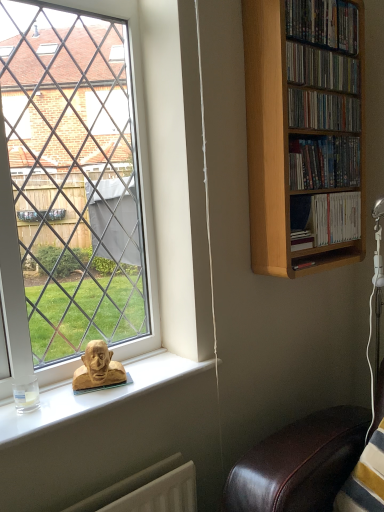
You are a GUI agent. You are given a task and a screenshot of the screen. Output one action in this format:
    pyautogui.click(x=<x>, y=<y>)
    Task: Click on the wooden shelf at upper right, marked as the second book in a top-to-bottom arrangement
    
    Given the screenshot: What is the action you would take?
    pyautogui.click(x=322, y=68)

In order to face light brown wooden bookcase at right, should I rotate leftwards or rightwards?

You should look right and rotate roughly 15.928 degrees.

This screenshot has width=384, height=512. Find the location of `wooden shelf at upper right, which is counted as the fourth book, starting from the bottom`. wooden shelf at upper right, which is counted as the fourth book, starting from the bottom is located at coordinates (322, 68).

Relative to wooden dvds at upper right, which is the third book from top to bottom, is translucent glass coffee cup at lower left in front or behind?

In the image, translucent glass coffee cup at lower left appears in front of wooden dvds at upper right, which is the third book from top to bottom.

Locate an element on the screen. coffee cup below the wooden dvds at upper right, arranged as the 3th book when ordered from the bottom (from a real-world perspective) is located at coordinates (26, 393).

How many degrees apart are the facing directions of translucent glass coffee cup at lower left and wooden dvds at upper right, which is the third book from top to bottom?

The angular difference between translucent glass coffee cup at lower left and wooden dvds at upper right, which is the third book from top to bottom, is 2.16 degrees.

Is translucent glass coffee cup at lower left to the left of wooden dvds at upper right, which is the third book from top to bottom, from the viewer's perspective?

Indeed, translucent glass coffee cup at lower left is positioned on the left side of wooden dvds at upper right, which is the third book from top to bottom.

From their relative heights in the image, would you say wooden sculpture at window is taller or shorter than translucent glass coffee cup at lower left?

wooden sculpture at window is taller than translucent glass coffee cup at lower left.

Is wooden sculpture at window in front of or behind translucent glass coffee cup at lower left in the image?

wooden sculpture at window is positioned farther from the viewer than translucent glass coffee cup at lower left.

Could you tell me if wooden sculpture at window is turned towards translucent glass coffee cup at lower left?

No, wooden sculpture at window is not turned towards translucent glass coffee cup at lower left.

Visually, is wooden sculpture at window positioned to the left or to the right of translucent glass coffee cup at lower left?

wooden sculpture at window is to the right of translucent glass coffee cup at lower left.

Between wooden dvds at upper right, arranged as the 1th book when viewed from the top, and wooden dvds at upper right, arranged as the 3th book when ordered from the bottom, which one has smaller size?

Smaller between the two is wooden dvds at upper right, arranged as the 3th book when ordered from the bottom.

Looking at this image, from a real-world perspective, is wooden dvds at upper right, arranged as the 1th book when viewed from the top, positioned above or below wooden dvds at upper right, arranged as the 3th book when ordered from the bottom?

Clearly, from a real-world perspective, wooden dvds at upper right, arranged as the 1th book when viewed from the top, is above wooden dvds at upper right, arranged as the 3th book when ordered from the bottom.

Considering the sizes of objects wooden dvds at upper right, arranged as the 1th book when viewed from the top, and wooden dvds at upper right, which is the third book from top to bottom, in the image provided, who is thinner, wooden dvds at upper right, arranged as the 1th book when viewed from the top, or wooden dvds at upper right, which is the third book from top to bottom,?

With smaller width is wooden dvds at upper right, which is the third book from top to bottom.

Which object is closer to the camera taking this photo, light brown wooden bookcase at right or translucent glass coffee cup at lower left?

Positioned in front is translucent glass coffee cup at lower left.

Considering the relative sizes of light brown wooden bookcase at right and translucent glass coffee cup at lower left in the image provided, is light brown wooden bookcase at right bigger than translucent glass coffee cup at lower left?

Indeed, light brown wooden bookcase at right has a larger size compared to translucent glass coffee cup at lower left.

From a real-world perspective, between light brown wooden bookcase at right and translucent glass coffee cup at lower left, who is vertically higher?

light brown wooden bookcase at right is physically above.

How many degrees apart are the facing directions of light brown wooden bookcase at right and translucent glass coffee cup at lower left?

There is a 2.48-degree angle between the facing directions of light brown wooden bookcase at right and translucent glass coffee cup at lower left.

Between translucent glass coffee cup at lower left and wooden sculpture at window, which one is positioned behind?

wooden sculpture at window is more distant.

Can you confirm if translucent glass coffee cup at lower left is shorter than wooden sculpture at window?

Correct, translucent glass coffee cup at lower left is not as tall as wooden sculpture at window.

From a real-world perspective, is translucent glass coffee cup at lower left located beneath wooden sculpture at window?

Indeed, from a real-world perspective, translucent glass coffee cup at lower left is positioned beneath wooden sculpture at window.

Find the location of a particular element. This screenshot has width=384, height=512. coffee cup located on the left of wooden sculpture at window is located at coordinates (26, 393).

Considering the relative sizes of wooden dvds at upper right, which is counted as the 5th book, starting from the bottom, and white paperbacks at upper right, which is counted as the fifth book, starting from the top, in the image provided, is wooden dvds at upper right, which is counted as the 5th book, starting from the bottom, shorter than white paperbacks at upper right, which is counted as the fifth book, starting from the top,?

Yes.

Is wooden dvds at upper right, which is counted as the 5th book, starting from the bottom, not within white paperbacks at upper right, the first book in the bottom-to-top sequence?

Yes.

Is wooden dvds at upper right, arranged as the 1th book when viewed from the top, smaller than white paperbacks at upper right, the first book in the bottom-to-top sequence?

Incorrect, wooden dvds at upper right, arranged as the 1th book when viewed from the top, is not smaller in size than white paperbacks at upper right, the first book in the bottom-to-top sequence.

Are wooden dvds at upper right, arranged as the 1th book when viewed from the top, and white paperbacks at upper right, which is counted as the fifth book, starting from the top, making contact?

wooden dvds at upper right, arranged as the 1th book when viewed from the top, and white paperbacks at upper right, which is counted as the fifth book, starting from the top, are not in contact.

Considering the sizes of objects translucent glass coffee cup at lower left and light brown wooden bookcase at right in the image provided, who is wider, translucent glass coffee cup at lower left or light brown wooden bookcase at right?

light brown wooden bookcase at right.

Based on the photo, from a real-world perspective, which is physically below, translucent glass coffee cup at lower left or light brown wooden bookcase at right?

In real-world perspective, translucent glass coffee cup at lower left is lower.

In the image, is translucent glass coffee cup at lower left positioned in front of or behind light brown wooden bookcase at right?

Visually, translucent glass coffee cup at lower left is located in front of light brown wooden bookcase at right.

Considering the relative positions of translucent glass coffee cup at lower left and light brown wooden bookcase at right in the image provided, is translucent glass coffee cup at lower left to the left of light brown wooden bookcase at right from the viewer's perspective?

Yes, translucent glass coffee cup at lower left is to the left of light brown wooden bookcase at right.

Starting from the translucent glass coffee cup at lower left, which book is the 3rd one behind? Please provide its 2D coordinates.

[(323, 111)]

You are a GUI agent. You are given a task and a screenshot of the screen. Output one action in this format:
    pyautogui.click(x=<x>, y=<y>)
    Task: Click on the coffee cup located on the left of wooden sculpture at window
    
    Given the screenshot: What is the action you would take?
    pyautogui.click(x=26, y=393)

Estimate the real-world distances between objects in this image. Which object is further from matte wooden shelf at upper right, the 2th book from the bottom, wooden sculpture at window or light brown wooden bookcase at right?

wooden sculpture at window is positioned further to the anchor matte wooden shelf at upper right, the 2th book from the bottom.

Considering their positions, is matte wooden shelf at upper right, which ranks as the fourth book in top-to-bottom order, positioned further to wooden dvds at upper right, which is the third book from top to bottom, than wooden sculpture at window?

The object further to wooden dvds at upper right, which is the third book from top to bottom, is wooden sculpture at window.

From the image, which object appears to be farther from wooden sculpture at window, matte wooden shelf at upper right, which ranks as the fourth book in top-to-bottom order, or light brown wooden bookcase at right?

Based on the image, matte wooden shelf at upper right, which ranks as the fourth book in top-to-bottom order, appears to be further to wooden sculpture at window.

Looking at the image, which one is located further to wooden dvds at upper right, which is the third book from top to bottom, matte wooden shelf at upper right, which ranks as the fourth book in top-to-bottom order, or wooden dvds at upper right, which is counted as the 5th book, starting from the bottom?

wooden dvds at upper right, which is counted as the 5th book, starting from the bottom, lies further to wooden dvds at upper right, which is the third book from top to bottom, than the other object.

Estimate the real-world distances between objects in this image. Which object is closer to matte wooden shelf at upper right, which ranks as the fourth book in top-to-bottom order, wooden sculpture at window or wooden shelf at upper right, which is counted as the fourth book, starting from the bottom?

Among the two, wooden shelf at upper right, which is counted as the fourth book, starting from the bottom, is located nearer to matte wooden shelf at upper right, which ranks as the fourth book in top-to-bottom order.

Considering their positions, is white paperbacks at upper right, which is counted as the fifth book, starting from the top, positioned further to wooden dvds at upper right, which is counted as the 5th book, starting from the bottom, than matte wooden shelf at upper right, which ranks as the fourth book in top-to-bottom order?

Based on the image, white paperbacks at upper right, which is counted as the fifth book, starting from the top, appears to be further to wooden dvds at upper right, which is counted as the 5th book, starting from the bottom.

Based on their spatial positions, is wooden shelf at upper right, which is counted as the fourth book, starting from the bottom, or wooden dvds at upper right, which is the third book from top to bottom, closer to wooden sculpture at window?

wooden dvds at upper right, which is the third book from top to bottom, is closer to wooden sculpture at window.

Consider the image. Based on their spatial positions, is wooden dvds at upper right, arranged as the 3th book when ordered from the bottom, or wooden sculpture at window closer to wooden shelf at upper right, marked as the second book in a top-to-bottom arrangement?

wooden dvds at upper right, arranged as the 3th book when ordered from the bottom, lies closer to wooden shelf at upper right, marked as the second book in a top-to-bottom arrangement, than the other object.

At what (x,y) coordinates should I click in order to perform the action: click on bookcase between wooden dvds at upper right, arranged as the 1th book when viewed from the top, and translucent glass coffee cup at lower left, in the vertical direction. Please return your answer as a coordinate pair (x, y). Image resolution: width=384 pixels, height=512 pixels. Looking at the image, I should click on (304, 133).

Identify the location of bookcase between wooden dvds at upper right, arranged as the 1th book when viewed from the top, and wooden sculpture at window, in the vertical direction. (304, 133).

Identify the location of bookcase between wooden sculpture at window and matte wooden shelf at upper right, which ranks as the fourth book in top-to-bottom order. (304, 133).

The image size is (384, 512). I want to click on bookcase that lies between wooden dvds at upper right, which is the third book from top to bottom, and white paperbacks at upper right, the first book in the bottom-to-top sequence, from top to bottom, so click(x=304, y=133).